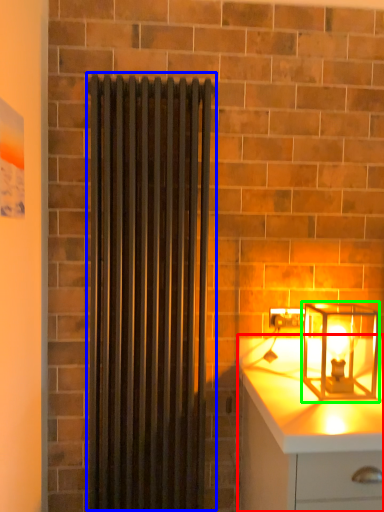
Question: Considering the real-world distances, which object is farthest from chest of drawers (highlighted by a red box)? shower curtain (highlighted by a blue box) or lamp (highlighted by a green box)?

Choices:
 (A) shower curtain
 (B) lamp

Answer: (A)